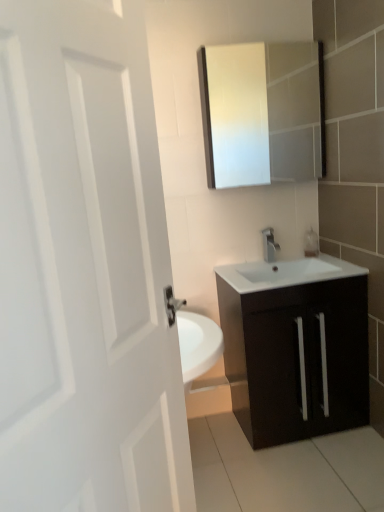
Question: From the image's perspective, is white glossy medicine cabinet at upper center located above or below matte dark wood cabinet at lower right?

Choices:
 (A) above
 (B) below

Answer: (A)

Question: Is white glossy medicine cabinet at upper center wider or thinner than matte dark wood cabinet at lower right?

Choices:
 (A) wide
 (B) thin

Answer: (B)

Question: Which object is positioned closest to the clear glass soap dispenser at right?

Choices:
 (A) matte dark wood cabinet at lower right
 (B) white glossy medicine cabinet at upper center
 (C) white matte door at left
 (D) silver metallic tap at center

Answer: (D)

Question: Which object is the closest to the white matte door at left?

Choices:
 (A) silver metallic tap at center
 (B) clear glass soap dispenser at right
 (C) white glossy medicine cabinet at upper center
 (D) matte dark wood cabinet at lower right

Answer: (D)